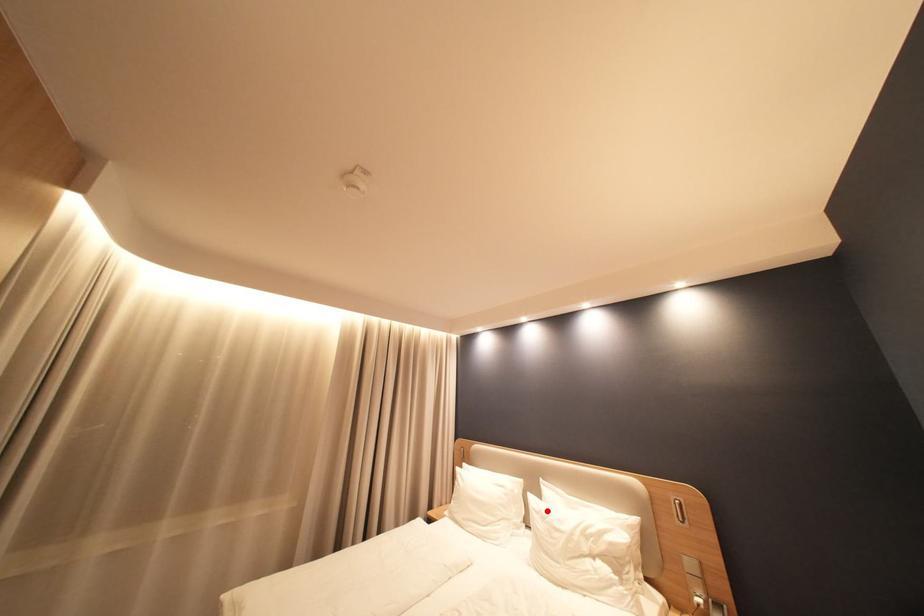
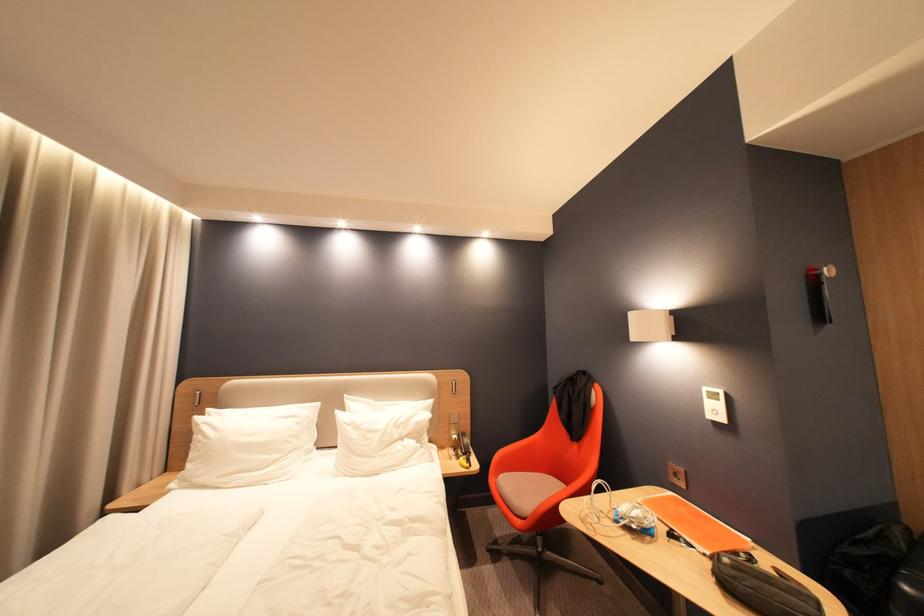
The point at the highlighted location is marked in the first image. Where is the corresponding point in the second image?

(359, 424)